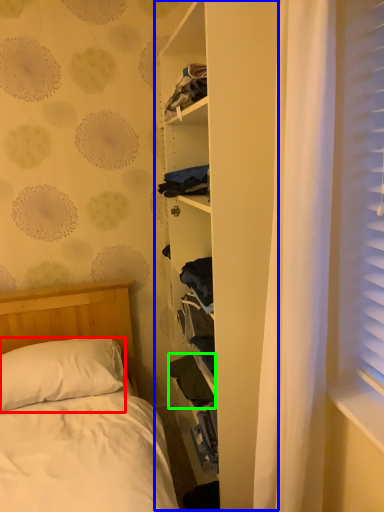
Question: Which is farther away from pillow (highlighted by a red box)? bookshelf (highlighted by a blue box) or clothing (highlighted by a green box)?

Choices:
 (A) bookshelf
 (B) clothing

Answer: (A)